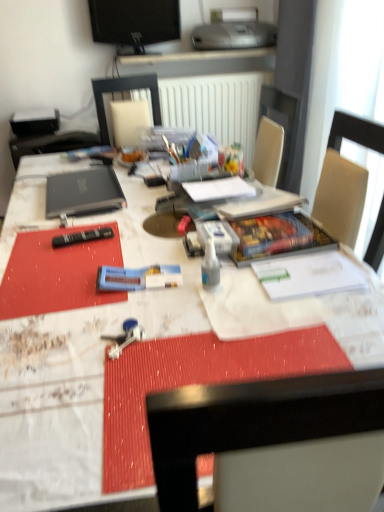
Where is `free space in front of blue plastic toothpaste tube at center`? Image resolution: width=384 pixels, height=512 pixels. free space in front of blue plastic toothpaste tube at center is located at coordinates (135, 321).